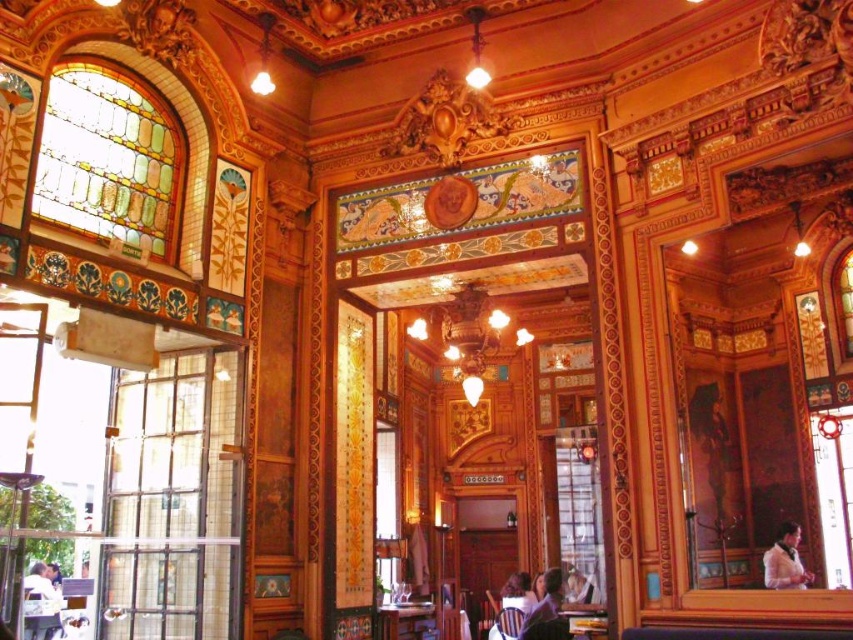
You are a customer sitting at the wooden table at center in the historic building. You want to check if your smooth brown hair at center is shorter than the table. Can you confirm this?

The wooden table at center is taller than smooth brown hair at center, so yes, your smooth brown hair at center is shorter than the table.

In the scene shown: You are a customer entering the historic building and see the wooden table at center and the smooth brown hair at center. Which object is located above the other?

The smooth brown hair at center is above the wooden table at center because it is positioned over it.